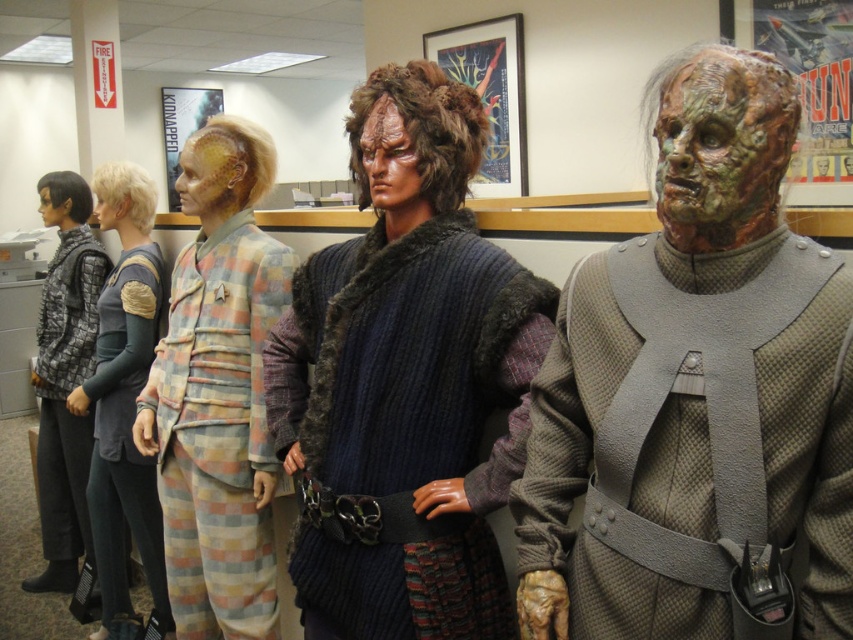
Can you confirm if gray textured uniform at center is positioned below smooth skin face at center?

Indeed, gray textured uniform at center is positioned under smooth skin face at center.

Which is behind, point (556, 448) or point (102, 214)?

Positioned behind is point (102, 214).

Measure the distance between gray textured uniform at center and camera.

gray textured uniform at center is 38.43 inches from camera.

The image size is (853, 640). I want to click on gray textured uniform at center, so click(692, 444).

Is greenish-brown textured mask at center smaller than matte black hair at left?

Correct, greenish-brown textured mask at center occupies less space than matte black hair at left.

What do you see at coordinates (709, 147) in the screenshot?
I see `greenish-brown textured mask at center` at bounding box center [709, 147].

At what (x,y) coordinates should I click in order to perform the action: click on greenish-brown textured mask at center. Please return your answer as a coordinate pair (x, y). The image size is (853, 640). Looking at the image, I should click on (709, 147).

Can you confirm if greenish-brown textured mask at center is shorter than greenish textured mask at center?

Yes.

Does point (746, 220) come closer to viewer compared to point (403, 148)?

That is True.

Identify the location of greenish-brown textured mask at center. (709, 147).